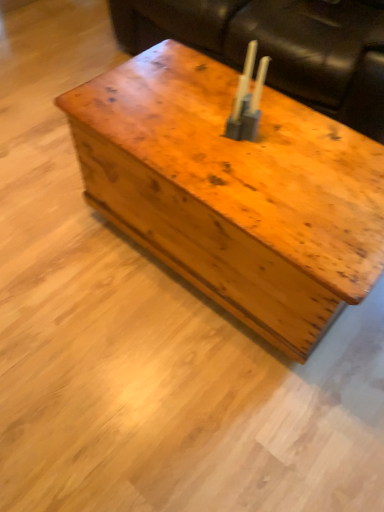
This screenshot has height=512, width=384. I want to click on vacant area located to the right-hand side of metallic silver candle holder at center, so click(296, 142).